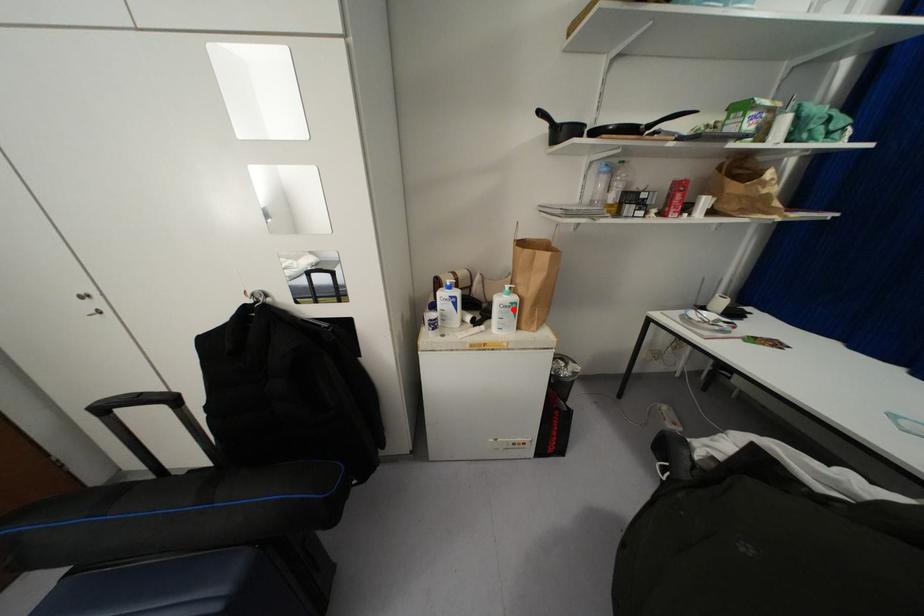
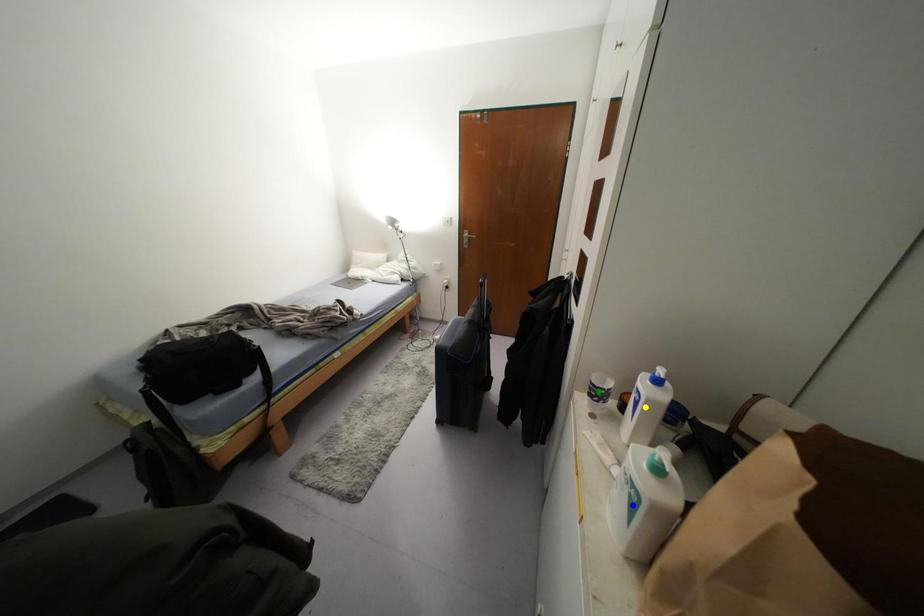
Question: I am providing you with two images of the same scene from different viewpoints. A red point is marked on the first image. You are given multiple points on the second image. Which point in image 2 represents the same 3d spot as the red point in image 1?

Choices:
 (A) green point
 (B) yellow point
 (C) blue point

Answer: (C)